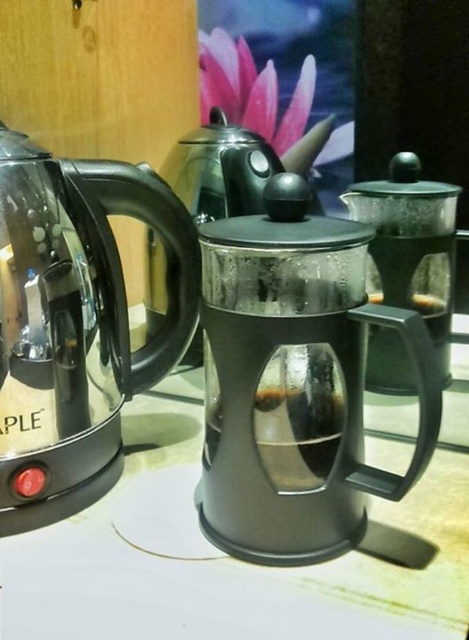
Does point (266, 524) lie behind point (407, 282)?

No, it is not.

What do you see at coordinates (295, 381) in the screenshot? I see `black plastic coffee maker at center` at bounding box center [295, 381].

Find the location of `black plastic coffee maker at center`. black plastic coffee maker at center is located at coordinates (295, 381).

Between black plastic coffee maker at center and shiny black kettle at left, which one has less height?

black plastic coffee maker at center

Is black plastic coffee maker at center behind shiny black kettle at left?

No, black plastic coffee maker at center is in front of shiny black kettle at left.

Where is `black plastic coffee maker at center`? The width and height of the screenshot is (469, 640). black plastic coffee maker at center is located at coordinates (295, 381).

The image size is (469, 640). What do you see at coordinates (75, 323) in the screenshot?
I see `shiny black kettle at left` at bounding box center [75, 323].

Can you confirm if shiny black kettle at left is thinner than transparent glass coffee press at center?

No.

Find the location of a particular element. Image resolution: width=469 pixels, height=640 pixels. shiny black kettle at left is located at coordinates (75, 323).